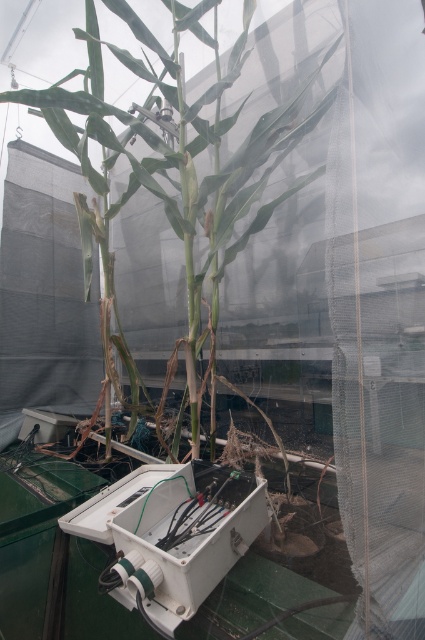
Question: Observing the image, what is the correct spatial positioning of green matte plant at center in reference to white plastic box at center?

Choices:
 (A) below
 (B) above

Answer: (B)

Question: Does green matte plant at center lie behind white plastic box at center?

Choices:
 (A) yes
 (B) no

Answer: (A)

Question: Is green matte plant at center closer to camera compared to white plastic box at center?

Choices:
 (A) yes
 (B) no

Answer: (B)

Question: Which object is closer to the camera taking this photo?

Choices:
 (A) green matte plant at center
 (B) white plastic box at center

Answer: (B)

Question: Which point appears closest to the camera in this image?

Choices:
 (A) (212, 481)
 (B) (155, 83)

Answer: (A)

Question: Among these objects, which one is nearest to the camera?

Choices:
 (A) green matte plant at center
 (B) white plastic box at center

Answer: (B)